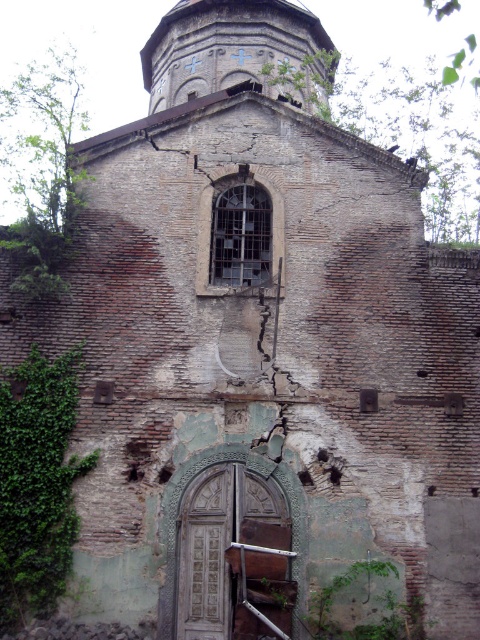
Question: Is green leafy ivy at lower left wider than wooden carved door at center?

Choices:
 (A) yes
 (B) no

Answer: (B)

Question: Which object appears farthest from the camera in this image?

Choices:
 (A) green leafy ivy at lower left
 (B) wooden carved door at center

Answer: (A)

Question: Which point is farther to the camera?

Choices:
 (A) green leafy ivy at lower left
 (B) wooden carved door at center

Answer: (A)

Question: Does green leafy ivy at lower left appear over wooden carved door at center?

Choices:
 (A) yes
 (B) no

Answer: (A)

Question: Does green leafy ivy at lower left have a lesser width compared to wooden carved door at center?

Choices:
 (A) no
 (B) yes

Answer: (B)